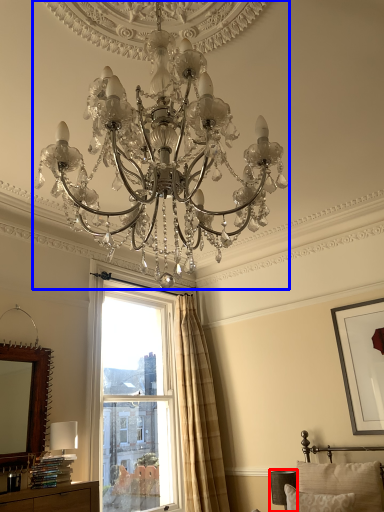
Question: Which object is further to the camera taking this photo, table lamp (highlighted by a red box) or lamp (highlighted by a blue box)?

Choices:
 (A) table lamp
 (B) lamp

Answer: (A)